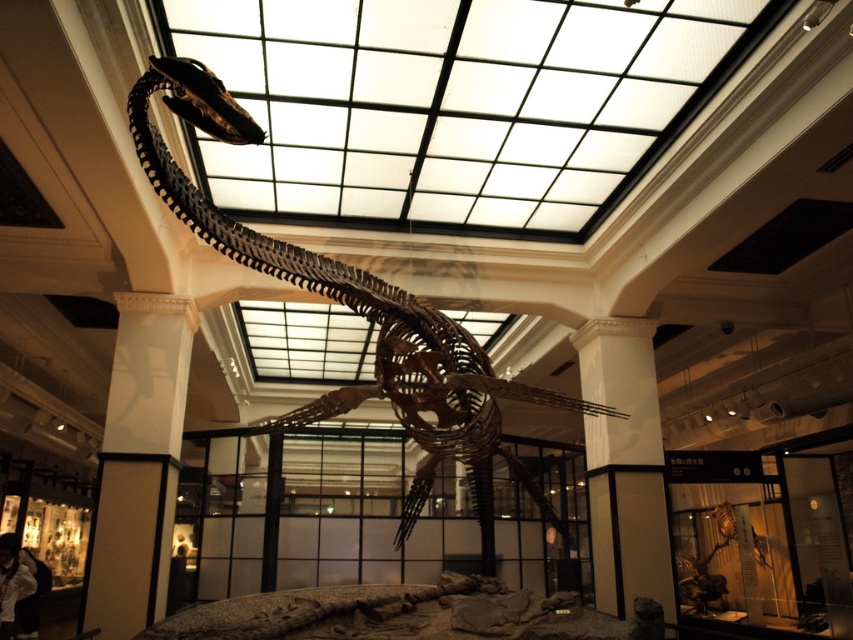
Locate an element on the screen. The width and height of the screenshot is (853, 640). white glossy pillar at lower left is located at coordinates (138, 465).

Locate an element on the screen. white glossy pillar at lower left is located at coordinates (138, 465).

Does brown wooden skeleton at center have a lesser height compared to white glossy pillar at lower left?

In fact, brown wooden skeleton at center may be taller than white glossy pillar at lower left.

Does brown wooden skeleton at center have a greater height compared to white glossy pillar at lower left?

Indeed, brown wooden skeleton at center has a greater height compared to white glossy pillar at lower left.

Locate an element on the screen. Image resolution: width=853 pixels, height=640 pixels. brown wooden skeleton at center is located at coordinates (350, 308).

Where is `brown wooden skeleton at center`? This screenshot has height=640, width=853. brown wooden skeleton at center is located at coordinates (350, 308).

Who is more forward, (x=469, y=436) or (x=607, y=397)?

Point (x=469, y=436) is more forward.

Is brown wooden skeleton at center bigger than white smooth pillar at center?

Correct, brown wooden skeleton at center is larger in size than white smooth pillar at center.

The height and width of the screenshot is (640, 853). In order to click on brown wooden skeleton at center in this screenshot , I will do `click(350, 308)`.

Image resolution: width=853 pixels, height=640 pixels. What are the coordinates of `brown wooden skeleton at center` in the screenshot? It's located at (350, 308).